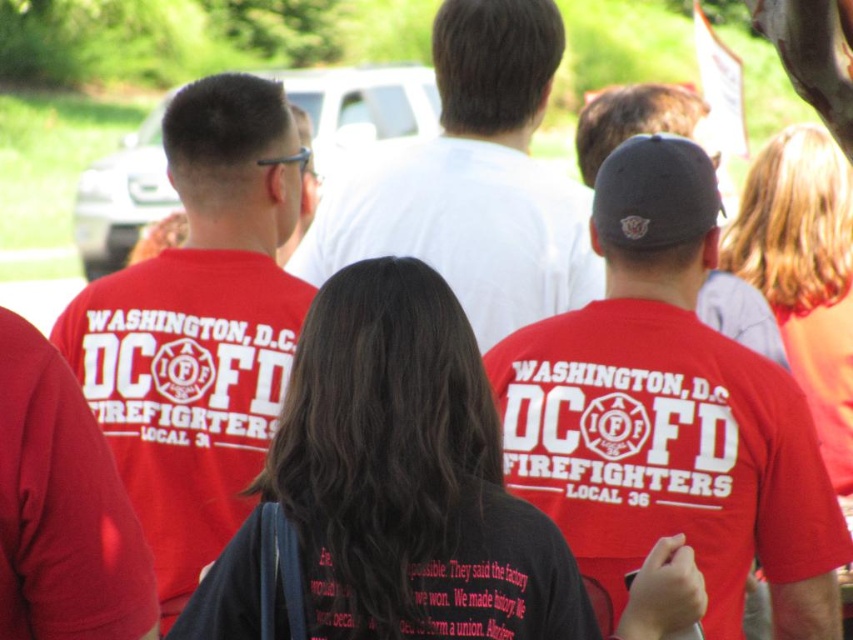
Which is more to the left, matte red t-shirt at center or white cotton shirt at center?

matte red t-shirt at center

Who is more distant from viewer, (527, 531) or (321, 266)?

The point (321, 266) is more distant.

Identify the location of matte red t-shirt at center. The image size is (853, 640). (393, 484).

Does matte red t-shirt at center lie in front of matte red shirt at center?

Yes, matte red t-shirt at center is closer to the viewer.

What do you see at coordinates (393, 484) in the screenshot? I see `matte red t-shirt at center` at bounding box center [393, 484].

I want to click on matte red t-shirt at center, so click(x=393, y=484).

Which is in front, point (635, 406) or point (531, 125)?

Point (635, 406)

Locate an element on the screen. The height and width of the screenshot is (640, 853). red matte t-shirt at center is located at coordinates (668, 416).